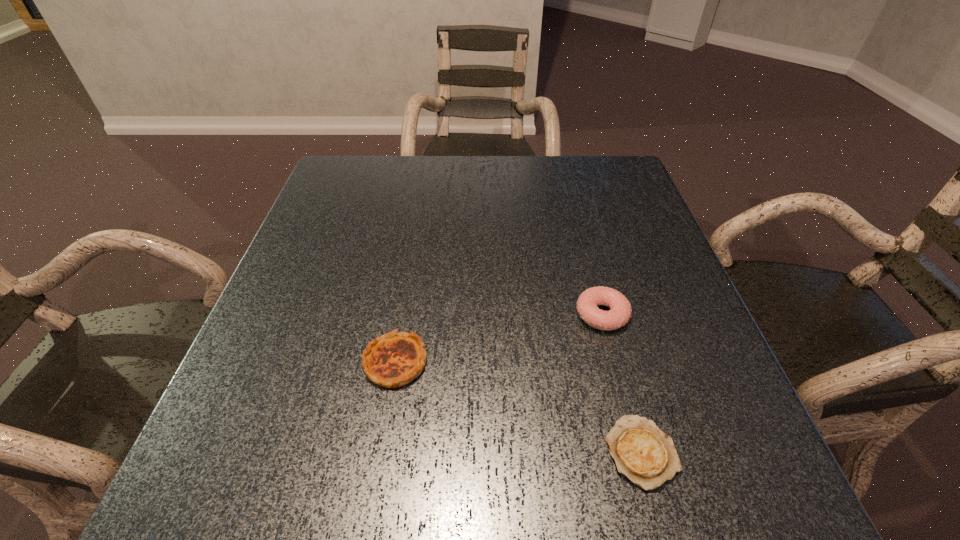
This screenshot has width=960, height=540. Find the location of `doughnut present at the right edge`. doughnut present at the right edge is located at coordinates (620, 313).

You are a GUI agent. You are given a task and a screenshot of the screen. Output one action in this format:
    pyautogui.click(x=<x>, y=<y>)
    Task: Click on the quiche located in the right edge section of the desktop
    
    Given the screenshot: What is the action you would take?
    pyautogui.click(x=642, y=452)

At what (x,y) coordinates should I click in order to perform the action: click on object that is at the near right corner. Please return your answer as a coordinate pair (x, y). This screenshot has width=960, height=540. Looking at the image, I should click on (642, 452).

The image size is (960, 540). In the image, there is a desktop. Identify the location of vacant space at the far edge. (474, 170).

What are the coordinates of `vacant area at the near edge of the desktop` in the screenshot? It's located at coord(631,517).

Identify the location of blank area at the left edge. (344, 320).

Find the location of a particular element. This screenshot has width=960, height=540. free space at the right edge of the desktop is located at coordinates (656, 418).

The height and width of the screenshot is (540, 960). I want to click on vacant region at the far left corner of the desktop, so click(376, 190).

Where is `vacant space at the far right corner`? The width and height of the screenshot is (960, 540). vacant space at the far right corner is located at coordinates (610, 194).

Find the location of a particular element. vacant area between the nearest object and the farthest object is located at coordinates click(x=621, y=383).